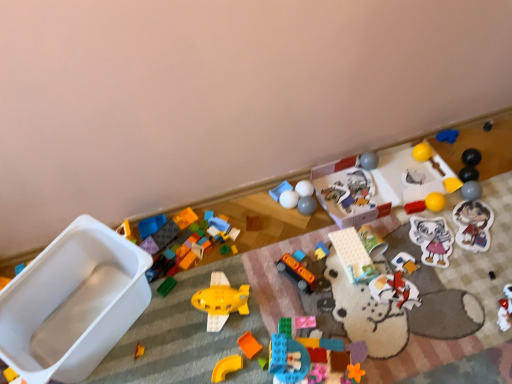
Where is `vacant area that lies between white glossy sticker at center-right, which is counted as the sixth toy, starting from the right, and yellow plastic curve at center, the fifth toy in the left-to-right sequence`? vacant area that lies between white glossy sticker at center-right, which is counted as the sixth toy, starting from the right, and yellow plastic curve at center, the fifth toy in the left-to-right sequence is located at coordinates (354, 293).